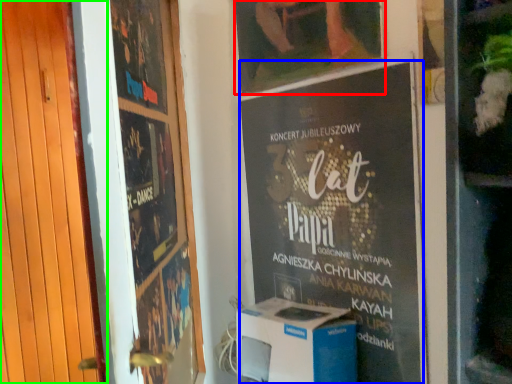
Question: Based on their relative distances, which object is farther from picture frame (highlighted by a red box)? Choose from poster (highlighted by a blue box) and door (highlighted by a green box).

Choices:
 (A) poster
 (B) door

Answer: (B)